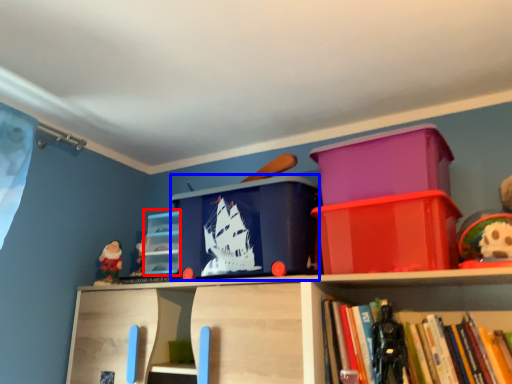
Question: Which point is closer to the camera, storage box (highlighted by a red box) or storage box (highlighted by a blue box)?

Choices:
 (A) storage box
 (B) storage box

Answer: (B)